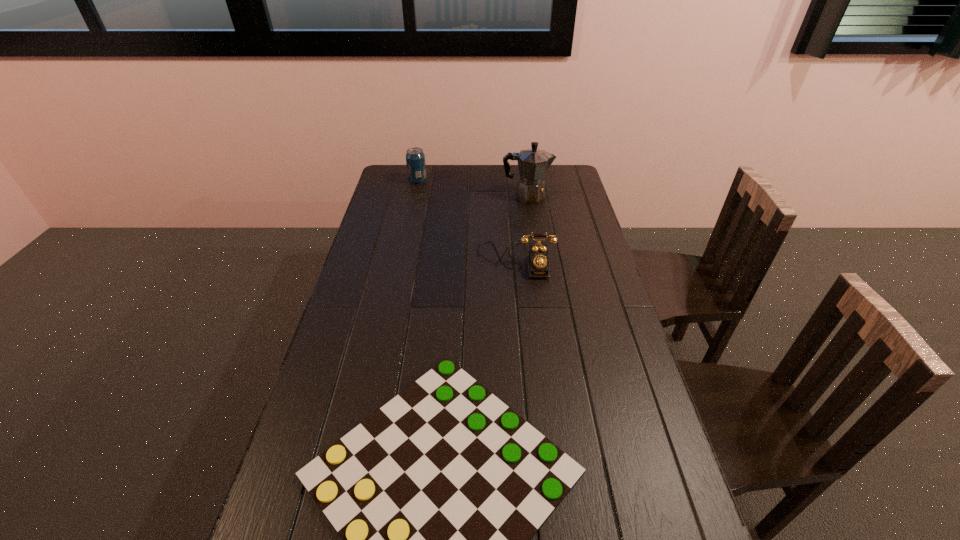
Where is `vacant point located between the third farthest object and the tallest object`? vacant point located between the third farthest object and the tallest object is located at coordinates (521, 228).

This screenshot has height=540, width=960. I want to click on vacant point located between the farthest object and the tallest object, so click(472, 189).

At what (x,y) coordinates should I click in order to perform the action: click on empty space between the pop soda and the third tallest object. Please return your answer as a coordinate pair (x, y). Looking at the image, I should click on (467, 220).

Locate an element on the screen. Image resolution: width=960 pixels, height=540 pixels. free space between the third farthest object and the farthest object is located at coordinates (467, 220).

The width and height of the screenshot is (960, 540). Find the location of `vacant area that lies between the tallest object and the pop soda`. vacant area that lies between the tallest object and the pop soda is located at coordinates (472, 189).

This screenshot has width=960, height=540. I want to click on unoccupied position between the tallest object and the second shortest object, so click(x=521, y=228).

Locate which object is the closest to the coffeepot. Please provide its 2D coordinates. Your answer should be formatted as a tuple, i.e. [(x, y)], where the tuple contains the x and y coordinates of a point satisfying the conditions above.

[(538, 259)]

Image resolution: width=960 pixels, height=540 pixels. What are the coordinates of `the third closest object relative to the coffeepot` in the screenshot? It's located at (436, 496).

You are a GUI agent. You are given a task and a screenshot of the screen. Output one action in this format:
    pyautogui.click(x=<x>, y=<y>)
    Task: Click on the vacant point that satisfies the following two spatial constraints: 1. on the pouring side of the coffeepot; 2. on the dial of the third farthest object
    The height and width of the screenshot is (540, 960).
    Given the screenshot: What is the action you would take?
    pyautogui.click(x=537, y=260)